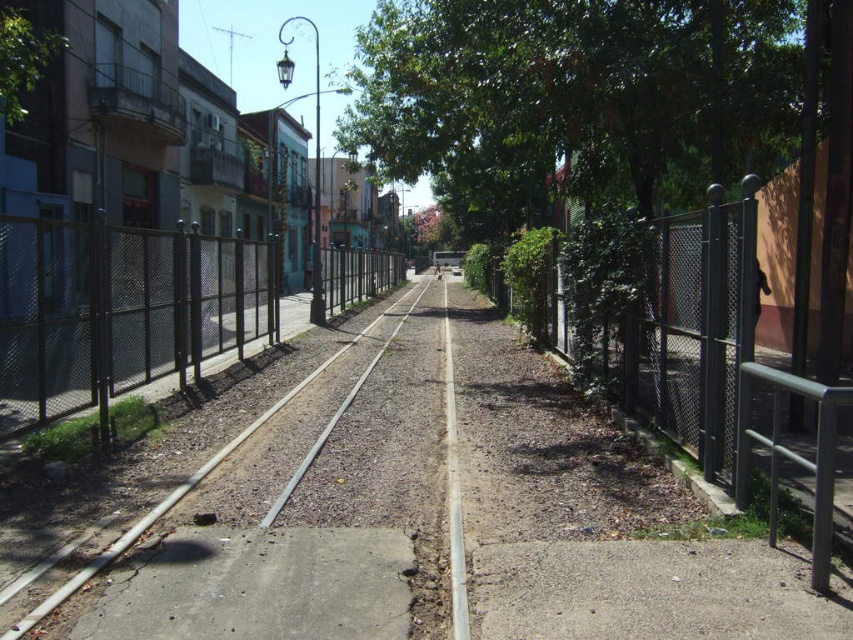
Can you confirm if black chain-link fence at left is positioned to the right of gray metallic train track at center?

No, black chain-link fence at left is not to the right of gray metallic train track at center.

Between black chain-link fence at left and gray metallic train track at center, which one is positioned higher?

black chain-link fence at left

Is point (134, 356) positioned after point (144, 522)?

Yes, point (134, 356) is behind point (144, 522).

Where is `black chain-link fence at left`? black chain-link fence at left is located at coordinates (119, 310).

Does gray metallic train track at center have a greater height compared to green leafy tree at upper left?

No.

Which is below, gray metallic train track at center or green leafy tree at upper left?

gray metallic train track at center is below.

In order to click on gray metallic train track at center in this screenshot , I will do `click(177, 492)`.

Identify the location of gray metallic train track at center. (177, 492).

Measure the distance between black chain-link fence at left and green leafy tree at upper left.

They are 14.01 feet apart.

Can you confirm if black chain-link fence at left is thinner than green leafy tree at upper left?

Yes, black chain-link fence at left is thinner than green leafy tree at upper left.

The width and height of the screenshot is (853, 640). I want to click on black chain-link fence at left, so click(119, 310).

Find the location of `black chain-link fence at left`. black chain-link fence at left is located at coordinates (119, 310).